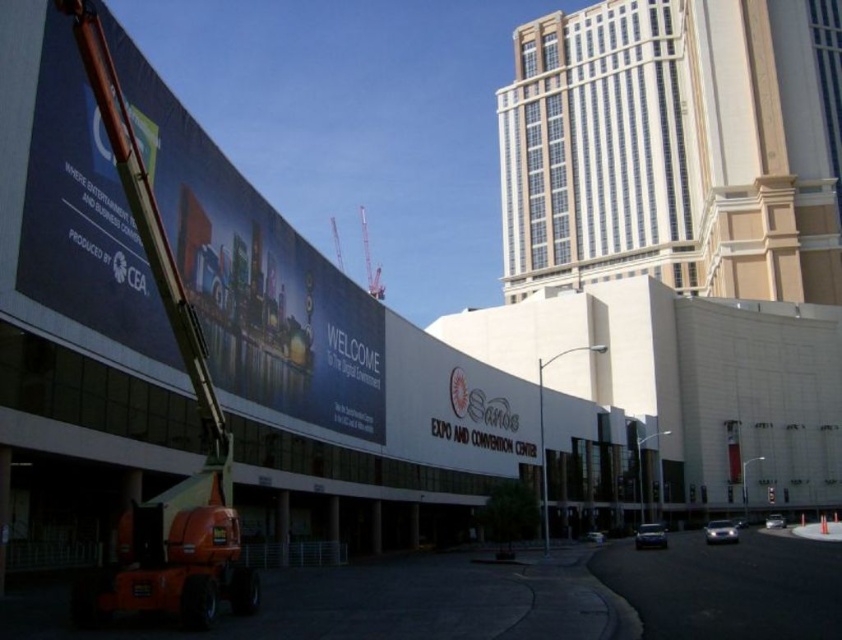
You are a photographer standing in front of the Expo and Convention Center. You notice the blue glossy billboard at upper left and the metallic red crane at center. Which object is taller?

The metallic red crane at center is taller than the blue glossy billboard at upper left.

You are standing at the center of the image. Which direction should you look to see the blue glossy billboard at upper left?

The blue glossy billboard at upper left is located at the upper left direction from your current position at the center of the image.